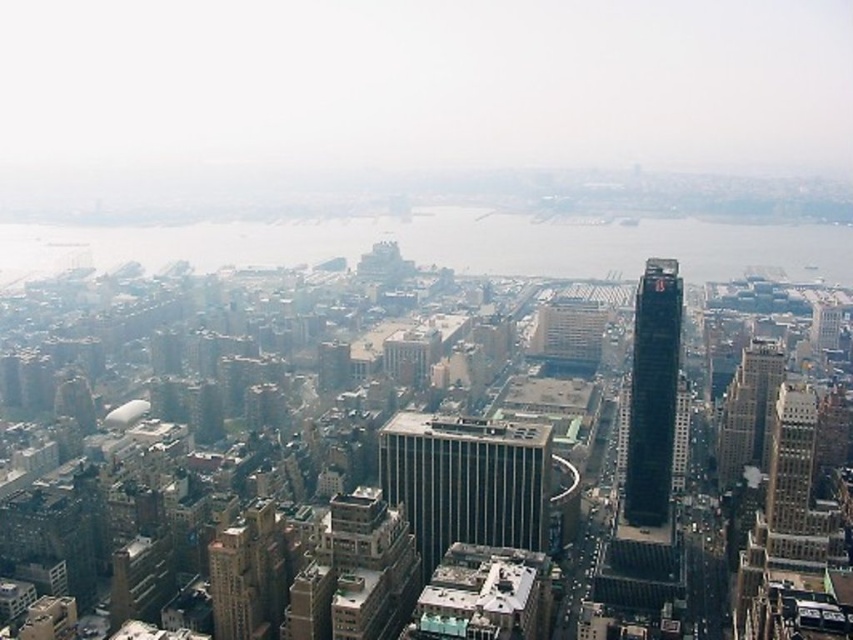
Question: Observing the image, what is the correct spatial positioning of dark gray glass skyscraper at center-right in reference to dark gray glass skyscraper at right?

Choices:
 (A) left
 (B) right

Answer: (A)

Question: Is black glass skyscraper at center-right positioned in front of dark gray glass skyscraper at right?

Choices:
 (A) no
 (B) yes

Answer: (B)

Question: Can you confirm if dark gray glass skyscraper at center-right is positioned to the left of dark gray glass skyscraper at right?

Choices:
 (A) yes
 (B) no

Answer: (A)

Question: Which of the following is the closest to the observer?

Choices:
 (A) gray concrete building at center
 (B) dark gray glass skyscraper at center-right
 (C) dark gray glass skyscraper at right
 (D) black glass skyscraper at center-right

Answer: (A)

Question: Which object appears farthest from the camera in this image?

Choices:
 (A) dark gray glass skyscraper at center-right
 (B) black glass skyscraper at center-right

Answer: (A)

Question: Which of these objects is positioned farthest from the black glass skyscraper at center-right?

Choices:
 (A) dark gray glass skyscraper at center-right
 (B) gray concrete building at center

Answer: (B)